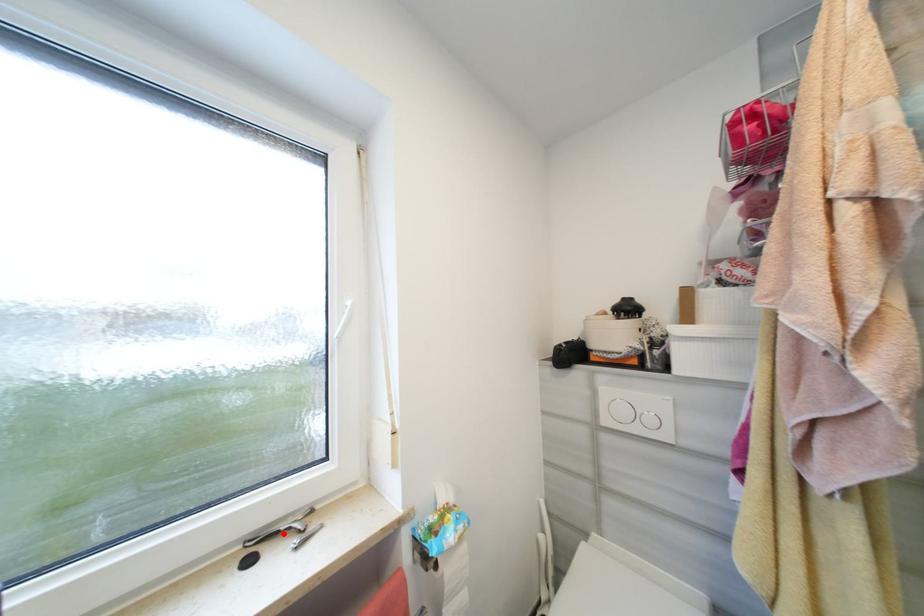
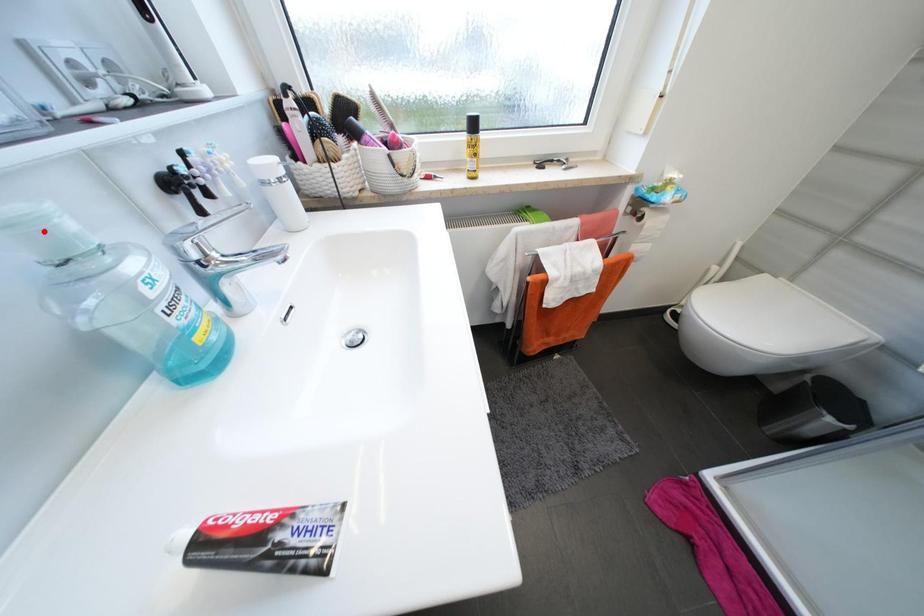
I am providing you with two images of the same scene from different viewpoints. A red point is marked on the first image and another point is marked on the second image. Is the red point in image1 aligned with the point shown in image2?

No